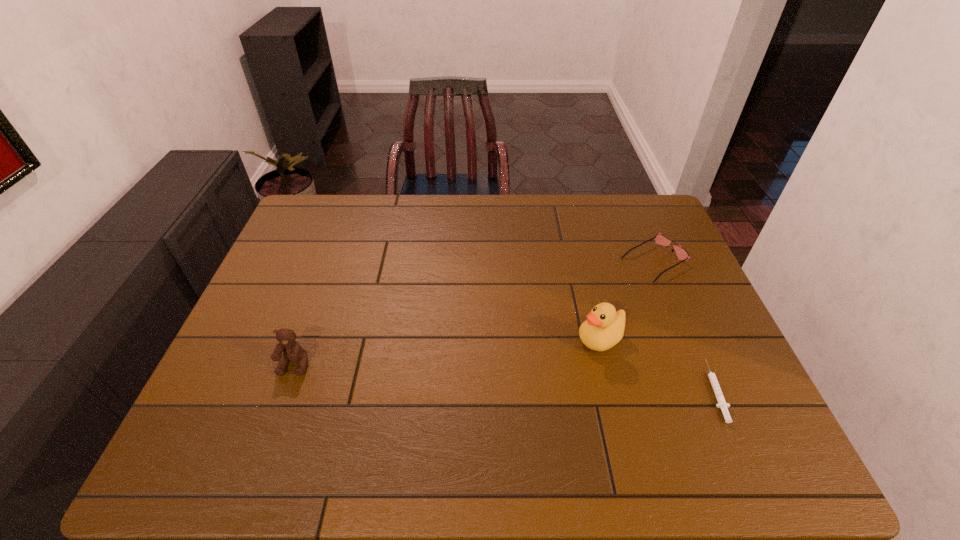
This screenshot has width=960, height=540. What are the coordinates of `free space at the far edge of the desktop` in the screenshot? It's located at (420, 222).

You are a GUI agent. You are given a task and a screenshot of the screen. Output one action in this format:
    pyautogui.click(x=<x>, y=<y>)
    Task: Click on the blank space at the near edge
    The image size is (960, 540).
    Given the screenshot: What is the action you would take?
    [604, 409]

At what (x,y) coordinates should I click in order to perform the action: click on vacant space at the left edge. Please return your answer as a coordinate pair (x, y). This screenshot has height=540, width=960. Looking at the image, I should click on (293, 267).

This screenshot has width=960, height=540. I want to click on vacant space at the right edge of the desktop, so click(721, 356).

The width and height of the screenshot is (960, 540). I want to click on free space at the far left corner of the desktop, so click(x=328, y=213).

This screenshot has height=540, width=960. Find the location of `vacant area at the far right corner`. vacant area at the far right corner is located at coordinates (648, 200).

Where is `vacant space that is in between the second object from left to right and the shortest object`? The image size is (960, 540). vacant space that is in between the second object from left to right and the shortest object is located at coordinates (658, 365).

Locate an element on the screen. This screenshot has height=540, width=960. vacant point located between the third object from right to left and the third tallest object is located at coordinates (627, 300).

Identify the location of free spot between the duck and the syringe. (658, 365).

The height and width of the screenshot is (540, 960). I want to click on free space that is in between the farthest object and the third shortest object, so click(474, 313).